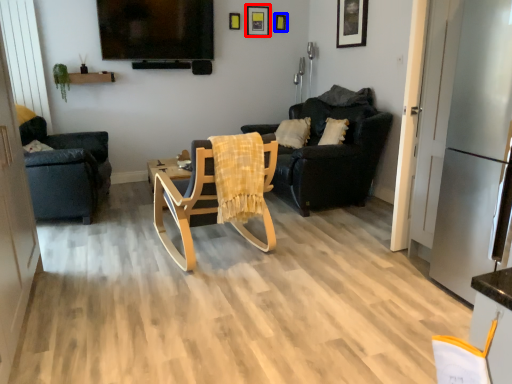
Question: Among these objects, which one is farthest to the camera, picture frame (highlighted by a red box) or picture frame (highlighted by a blue box)?

Choices:
 (A) picture frame
 (B) picture frame

Answer: (B)